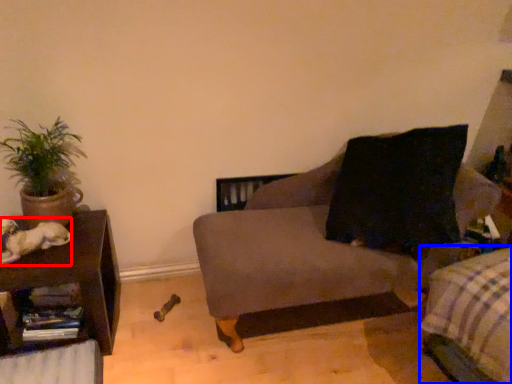
Question: Among these objects, which one is nearest to the camera, animal (highlighted by a red box) or bedding (highlighted by a blue box)?

Choices:
 (A) animal
 (B) bedding

Answer: (B)